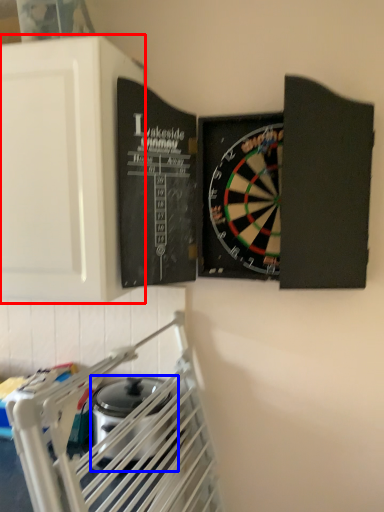
Question: Which point is closer to the camera, cabinetry (highlighted by a red box) or appliance (highlighted by a blue box)?

Choices:
 (A) cabinetry
 (B) appliance

Answer: (A)